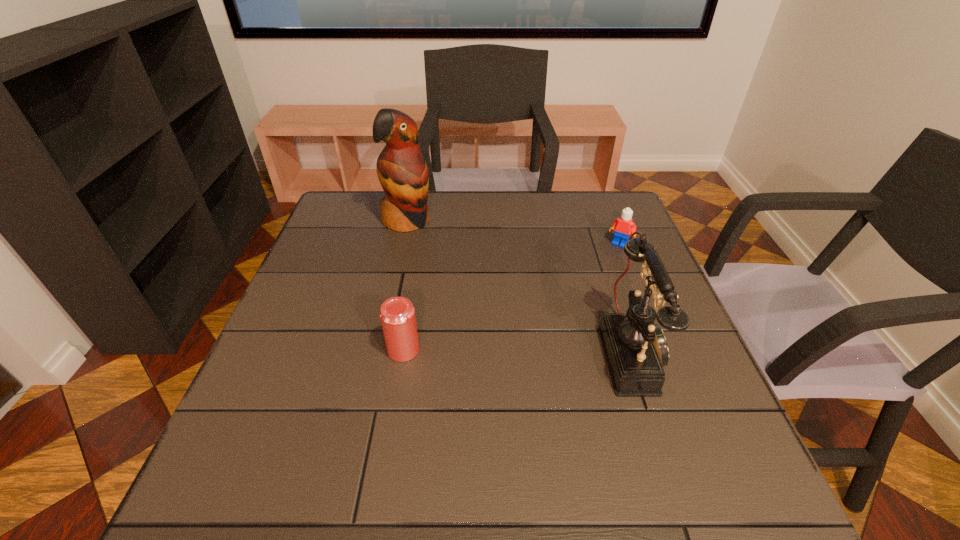
Locate an element on the screen. The width and height of the screenshot is (960, 540). unoccupied position between the Lego and the telephone is located at coordinates (626, 298).

Locate an element on the screen. Image resolution: width=960 pixels, height=540 pixels. free space that is in between the second farthest object and the second tallest object is located at coordinates pos(626,298).

Find the location of a particular element. The image size is (960, 540). empty space that is in between the third shortest object and the second farthest object is located at coordinates (626, 298).

Find the location of `free space between the third nearest object and the farthest object`. free space between the third nearest object and the farthest object is located at coordinates (514, 233).

In order to click on object that ranks as the third closest to the second tallest object in this screenshot , I will do `click(402, 171)`.

Identify which object is located as the third nearest to the Lego. Please provide its 2D coordinates. Your answer should be formatted as a tuple, i.e. [(x, y)], where the tuple contains the x and y coordinates of a point satisfying the conditions above.

[(397, 314)]

Locate an element on the screen. Image resolution: width=960 pixels, height=540 pixels. vacant space that satisfies the following two spatial constraints: 1. on the front side of the telephone; 2. on the dial of the parrot is located at coordinates (378, 352).

Locate an element on the screen. The image size is (960, 540). vacant space that satisfies the following two spatial constraints: 1. on the front side of the tallest object; 2. on the right side of the beer can is located at coordinates (379, 350).

Image resolution: width=960 pixels, height=540 pixels. In order to click on vacant space that satisfies the following two spatial constraints: 1. on the front side of the beer can; 2. on the left side of the parrot in this screenshot , I will do (379, 350).

At what (x,y) coordinates should I click in order to perform the action: click on free region that satisfies the following two spatial constraints: 1. on the back side of the third nearest object; 2. on the left side of the beer can. Please return your answer as a coordinate pair (x, y). The width and height of the screenshot is (960, 540). Looking at the image, I should click on (421, 244).